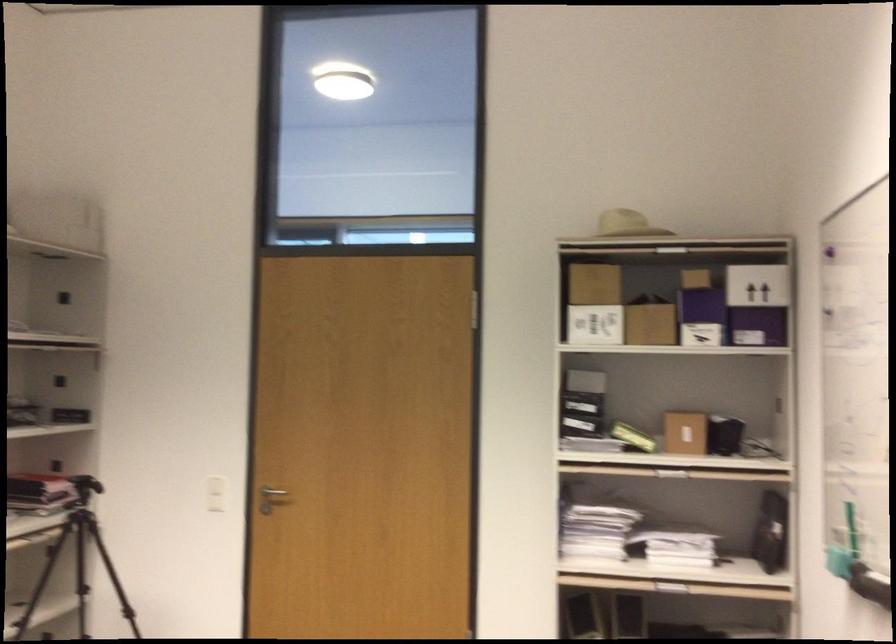
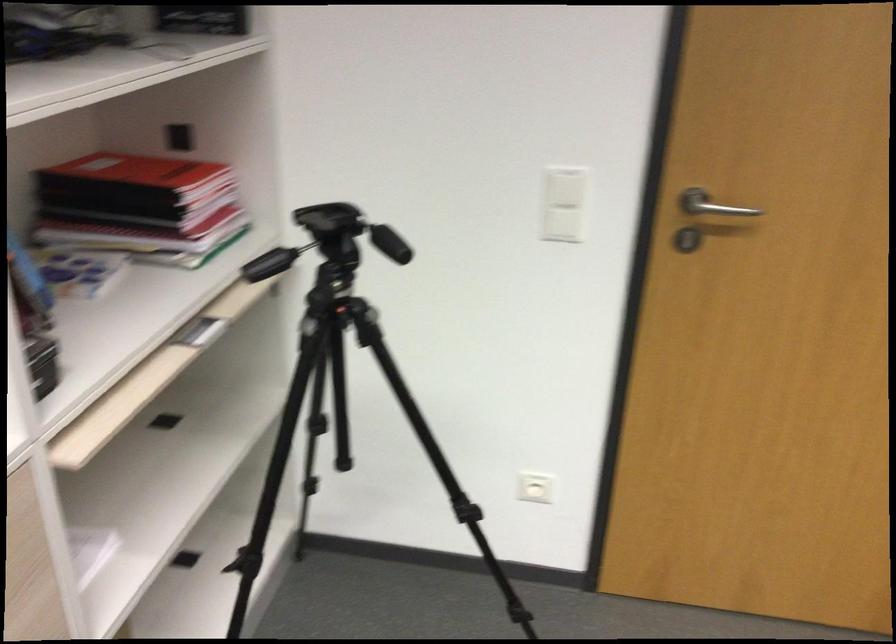
In the second image, find the point that corresponds to (x=82, y=518) in the first image.

(334, 313)